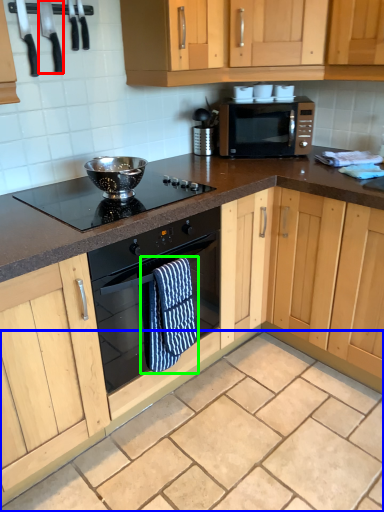
Question: Considering the real-world distances, which object is closest to appliance (highlighted by a red box)? granite (highlighted by a blue box) or bath towel (highlighted by a green box).

Choices:
 (A) granite
 (B) bath towel

Answer: (B)